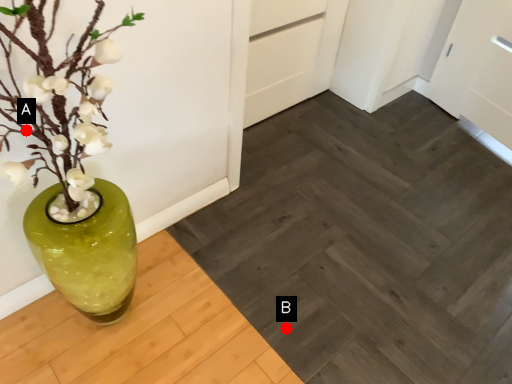
Question: Two points are circled on the image, labeled by A and B beside each circle. Which point is farther from the camera taking this photo?

Choices:
 (A) A is further
 (B) B is further

Answer: (B)